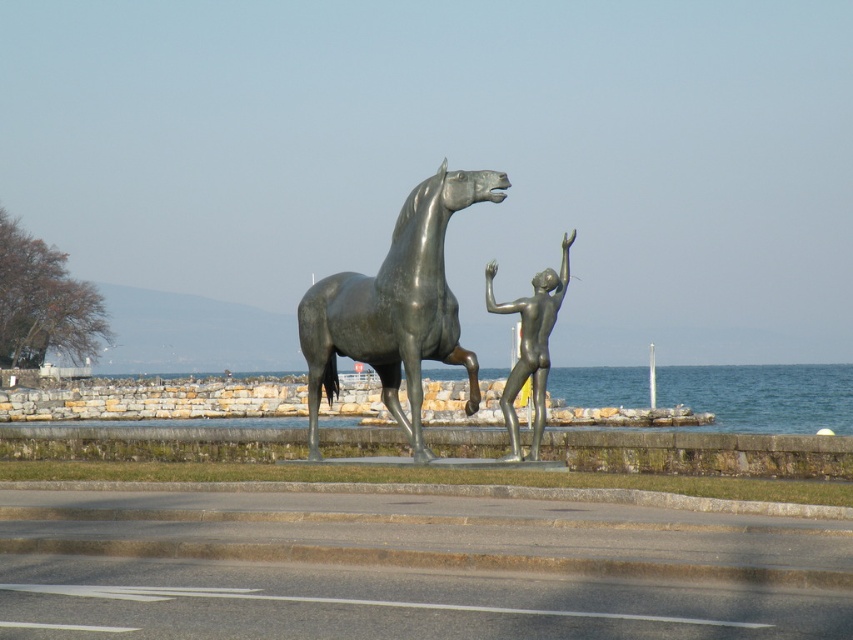
You are an art student analyzing the sculpture. You need to determine which object is taller between the bronze horse at center and the bronze nude figure at center. Which one is taller?

The bronze horse at center is taller than the bronze nude figure at center according to the description.

You are an art student analyzing the sculpture. You notice a point at coordinates (396, 307). Which part of the sculpture does this point correspond to?

The point at coordinates (396, 307) corresponds to the bronze horse at center.

You are an art student analyzing the sculpture. You notice the bronze horse at center and the bronze nude figure at center. Which one is located to the left of the other?

The bronze horse at center is positioned on the left side of bronze nude figure at center.